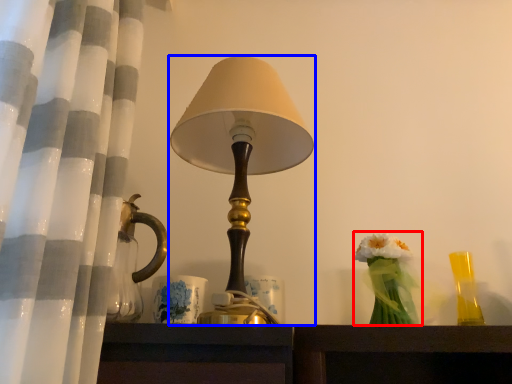
Question: Which object is closer to the camera taking this photo, floral arrangement (highlighted by a red box) or lamp (highlighted by a blue box)?

Choices:
 (A) floral arrangement
 (B) lamp

Answer: (B)